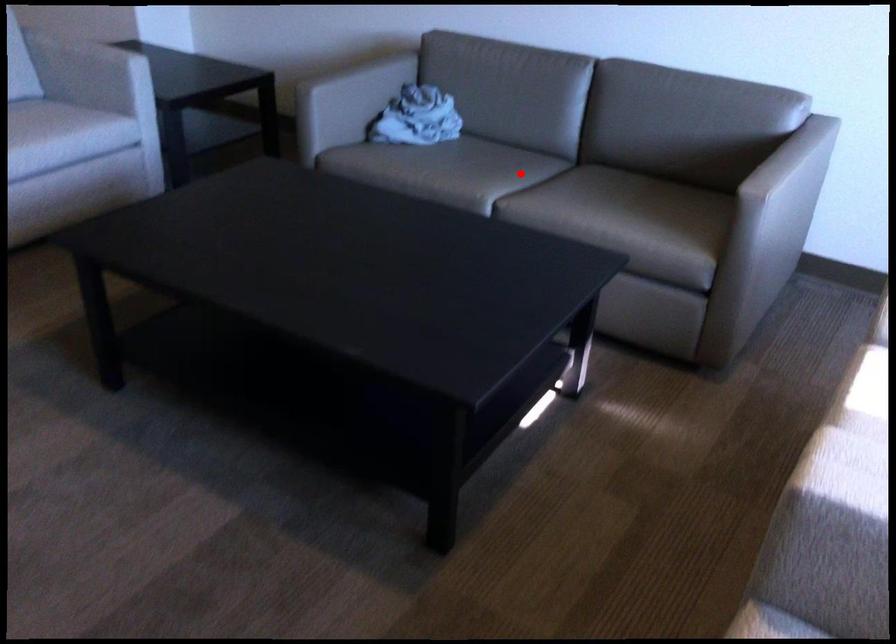
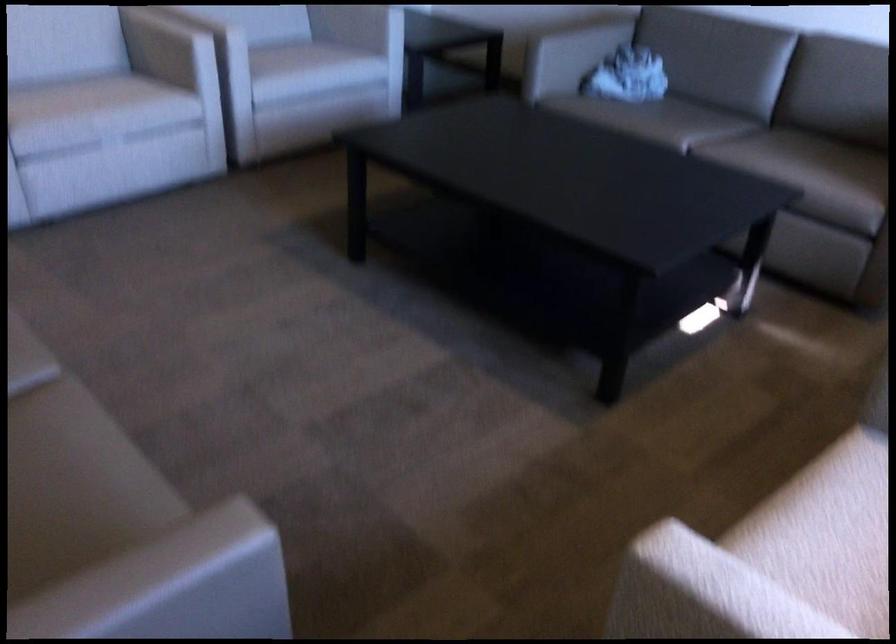
The point at the highlighted location is marked in the first image. Where is the corresponding point in the second image?

(714, 127)